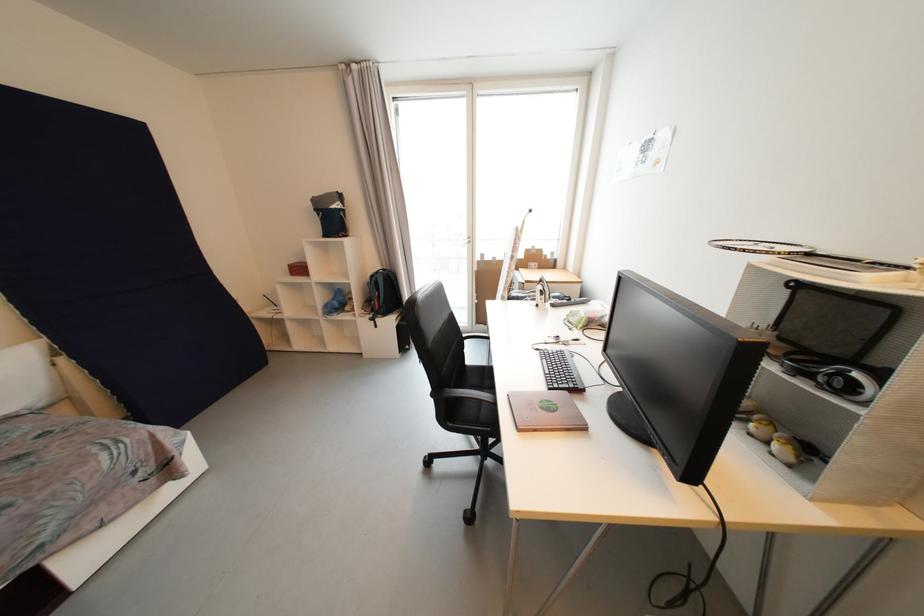
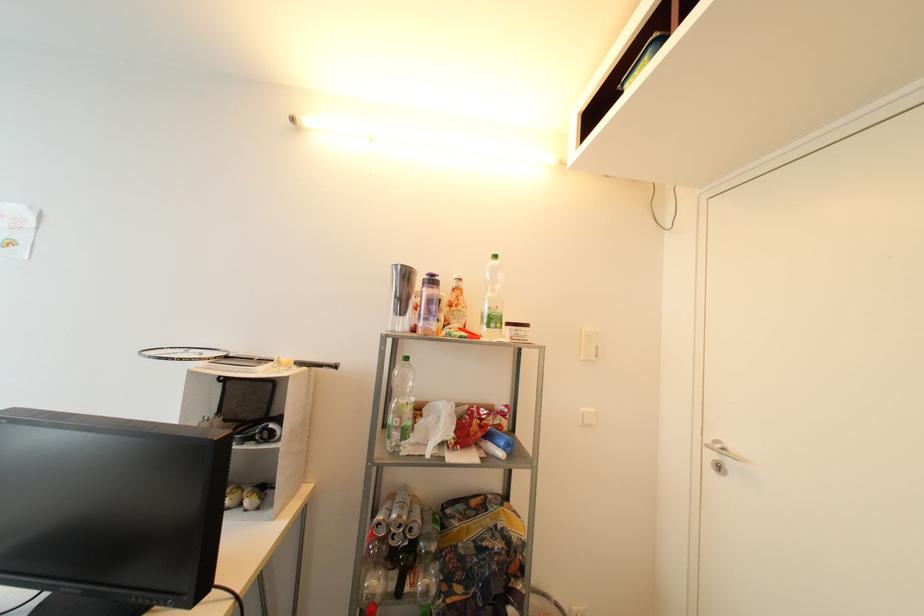
Question: How did the camera likely rotate?

Choices:
 (A) Left
 (B) Right
 (C) Up
 (D) Down

Answer: (B)